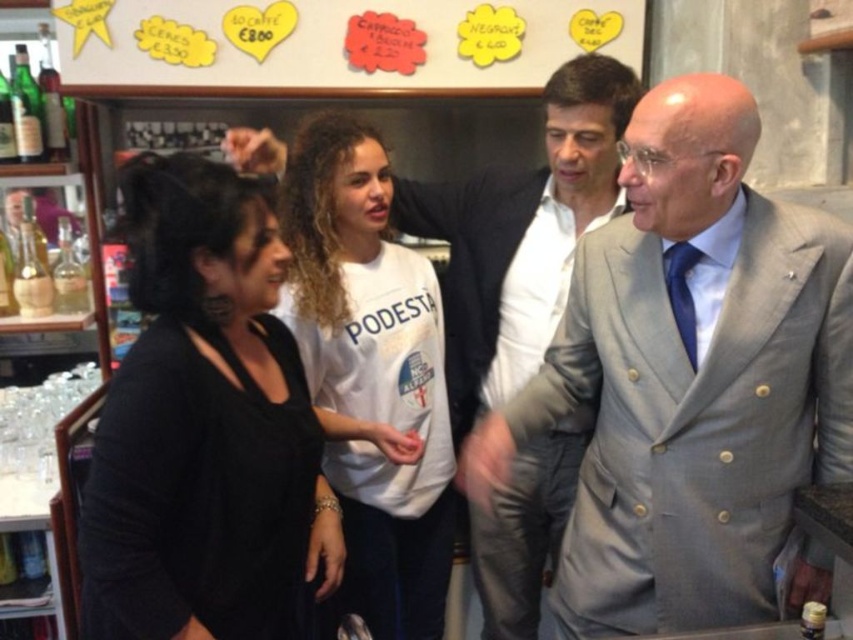
In order to click on black matte shirt at left in this screenshot , I will do (x=204, y=428).

Can you confirm if black matte shirt at left is taller than light gray suit at center?

No, black matte shirt at left is not taller than light gray suit at center.

Measure the distance between black matte shirt at left and camera.

black matte shirt at left is 3.60 feet away from camera.

This screenshot has width=853, height=640. I want to click on black matte shirt at left, so click(x=204, y=428).

Can you confirm if white cotton t-shirt at center is thinner than white paperboard at upper center?

Yes, white cotton t-shirt at center is thinner than white paperboard at upper center.

Which is above, white cotton t-shirt at center or white paperboard at upper center?

white paperboard at upper center is above.

Locate an element on the screen. white cotton t-shirt at center is located at coordinates (370, 374).

Does gray wool suit at center have a lesser width compared to white paperboard at upper center?

Yes.

Is the position of gray wool suit at center more distant than that of white paperboard at upper center?

No, it is not.

Find the location of a particular element. gray wool suit at center is located at coordinates (688, 378).

The width and height of the screenshot is (853, 640). In order to click on gray wool suit at center in this screenshot , I will do `click(688, 378)`.